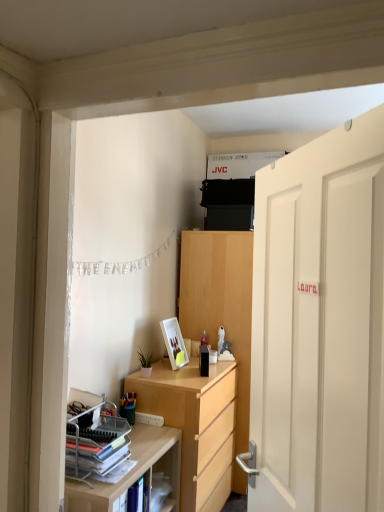
Question: In terms of size, does multicolored plastic pencil case at lower left appear bigger or smaller than white glossy picture frame at lower center?

Choices:
 (A) big
 (B) small

Answer: (B)

Question: From a real-world perspective, is multicolored plastic pencil case at lower left physically located above or below white glossy picture frame at lower center?

Choices:
 (A) above
 (B) below

Answer: (B)

Question: Which of these objects is positioned closest to the stacked matte paper at left?

Choices:
 (A) white glossy picture frame at lower center
 (B) light wood cabinet at center
 (C) light wood desk at center
 (D) white matte door at right
 (E) light wood shelf at lower left

Answer: (E)

Question: Estimate the real-world distances between objects in this image. Which object is closer to the silver metallic banner at upper left?

Choices:
 (A) multicolored plastic pencil case at lower left
 (B) light wood cabinet at center
 (C) light wood desk at center
 (D) stacked matte paper at left
 (E) white matte door at right

Answer: (B)